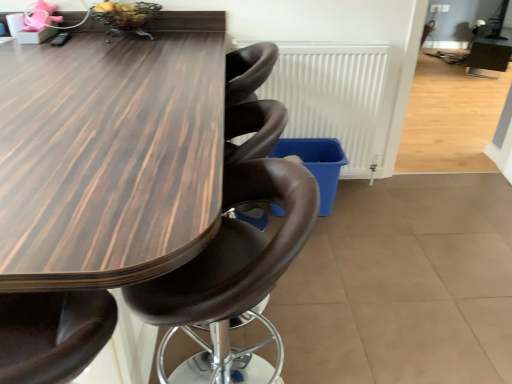
Where is `free space above wooden table at center (from a real-world perspective)`? free space above wooden table at center (from a real-world perspective) is located at coordinates (101, 116).